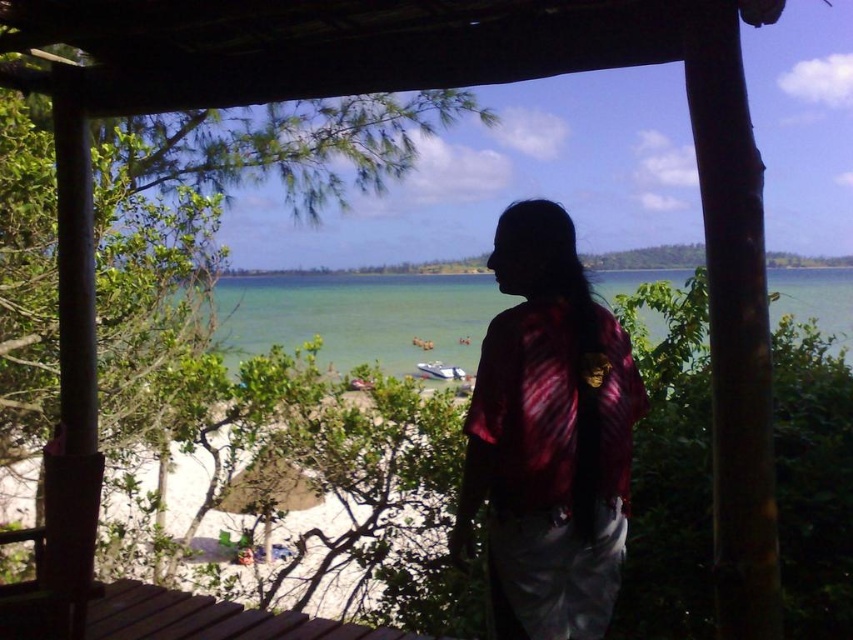
Question: Can you confirm if clear water at center is positioned below white glossy boat at center?

Choices:
 (A) no
 (B) yes

Answer: (A)

Question: Does maroon tie-dye shirt at center appear over clear water at center?

Choices:
 (A) yes
 (B) no

Answer: (B)

Question: Which of the following is the closest to the observer?

Choices:
 (A) (558, 326)
 (B) (450, 369)
 (C) (379, 321)
 (D) (120, 620)

Answer: (A)

Question: Does maroon tie-dye shirt at center have a smaller size compared to clear water at center?

Choices:
 (A) no
 (B) yes

Answer: (B)

Question: Which object is closer to the camera taking this photo?

Choices:
 (A) brown wooden deck at lower left
 (B) clear water at center
 (C) maroon tie-dye shirt at center

Answer: (C)

Question: Which object is positioned closest to the white glossy boat at center?

Choices:
 (A) clear water at center
 (B) maroon tie-dye shirt at center

Answer: (A)